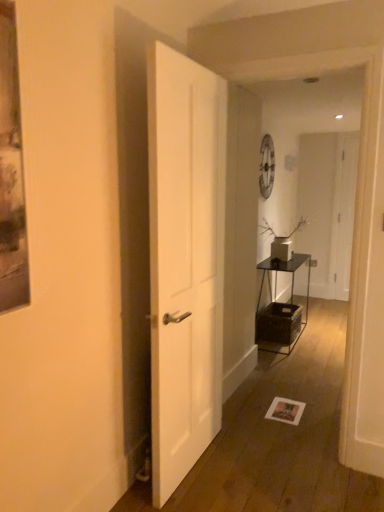
Locate an element on the screen. vacant point to the right of white matte door at center, the first door in the front-to-back sequence is located at coordinates (258, 465).